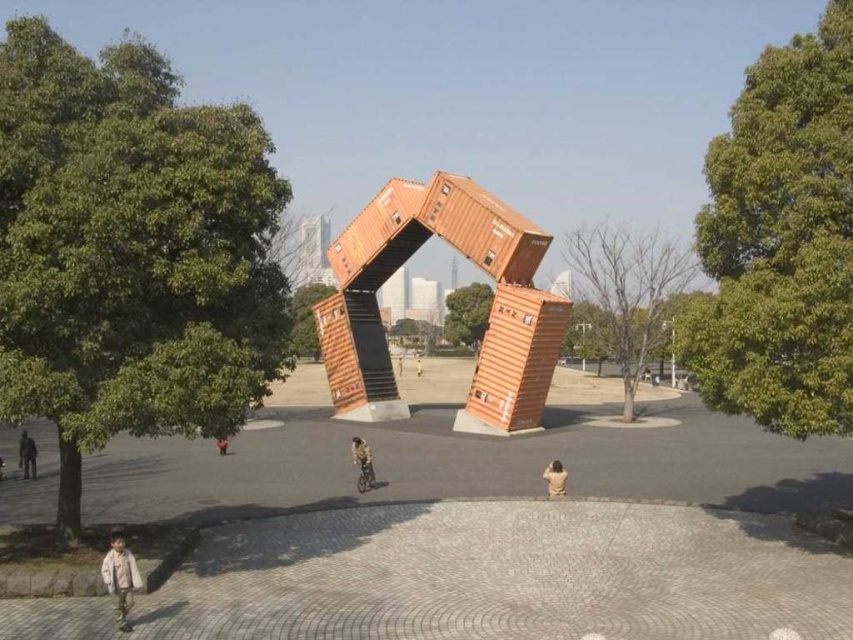
From the picture: You are standing at the base of the arch structure and notice a light brown cotton jacket at lower left and a light brown wooden bench at center. Which object is closer to you?

The light brown cotton jacket at lower left is closer to you because it is in front of the light brown wooden bench at center.

You are standing in front of the shipping container arch and want to sit down. You see a bare wood tree at center and a light brown wooden bench at center. Which object is closer to you?

The bare wood tree at center is closer to the viewer than the light brown wooden bench at center, so the tree is closer.

You are a photographer planning to take a picture of the orange shipping container arch. You notice a yellow fabric jacket at center and a yellow fabric person at center in the scene. Which object should you avoid including in your photo if you want to minimize the distraction from the main subject?

The yellow fabric jacket at center is thinner than the yellow fabric person at center, so the yellow fabric person at center is more distracting and should be avoided to keep the focus on the orange shipping container arch.